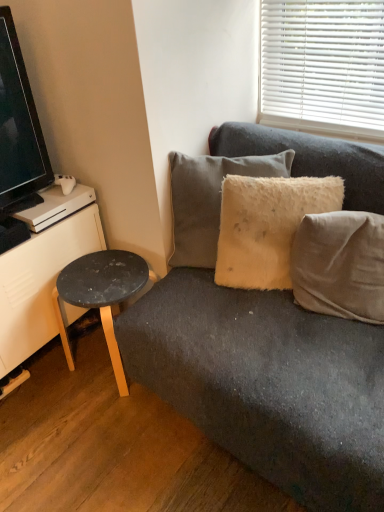
Question: In the image, is fuzzy beige pillow at upper right, marked as the 1th pillow in a left-to-right arrangement, positioned in front of or behind black laminate stool at lower left?

Choices:
 (A) front
 (B) behind

Answer: (A)

Question: From the image's perspective, is fuzzy beige pillow at upper right, which is the third pillow in right-to-left order, located above or below black laminate stool at lower left?

Choices:
 (A) below
 (B) above

Answer: (B)

Question: Estimate the real-world distances between objects in this image. Which object is farther from the fuzzy beige pillow at upper right, which is the third pillow in right-to-left order?

Choices:
 (A) beige cotton cushion at right, the 3th pillow viewed from the left
 (B) fuzzy yellow pillow at center, which appears as the 2th pillow when viewed from the left
 (C) white matte dresser at left
 (D) black glossy tv at left
 (E) black laminate stool at lower left

Answer: (D)

Question: Considering the real-world distances, which object is closest to the fuzzy yellow pillow at center, which appears as the 2th pillow when viewed from the left?

Choices:
 (A) black glossy tv at left
 (B) black laminate stool at lower left
 (C) beige cotton cushion at right, the 3th pillow viewed from the left
 (D) fuzzy beige pillow at upper right, which is the third pillow in right-to-left order
 (E) white matte dresser at left

Answer: (C)